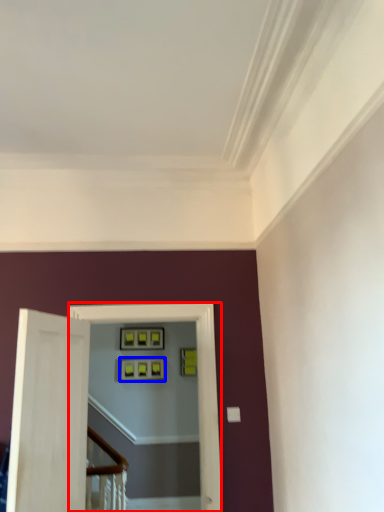
Question: Among these objects, which one is farthest to the camera, passage (highlighted by a red box) or picture frame (highlighted by a blue box)?

Choices:
 (A) passage
 (B) picture frame

Answer: (B)